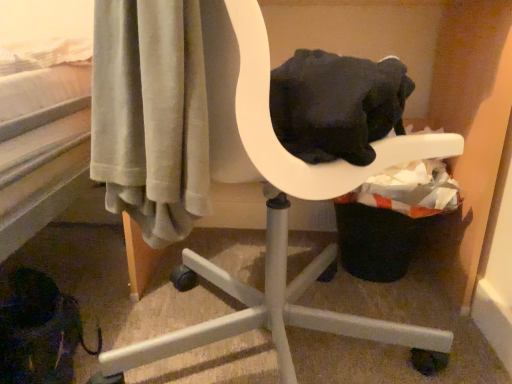
Question: Is black fabric laundry basket at lower right smaller than white plastic chair at center?

Choices:
 (A) yes
 (B) no

Answer: (A)

Question: Can you confirm if black fabric laundry basket at lower right is shorter than white plastic chair at center?

Choices:
 (A) no
 (B) yes

Answer: (B)

Question: Is black fabric laundry basket at lower right thinner than white plastic chair at center?

Choices:
 (A) yes
 (B) no

Answer: (A)

Question: Does black fabric laundry basket at lower right lie behind white plastic chair at center?

Choices:
 (A) no
 (B) yes

Answer: (B)

Question: From the image's perspective, is black fabric laundry basket at lower right on top of white plastic chair at center?

Choices:
 (A) no
 (B) yes

Answer: (A)

Question: Does black fabric laundry basket at lower right have a greater width compared to white plastic chair at center?

Choices:
 (A) yes
 (B) no

Answer: (B)

Question: Considering the relative sizes of white plastic chair at center and black fabric laundry basket at lower right in the image provided, is white plastic chair at center wider than black fabric laundry basket at lower right?

Choices:
 (A) no
 (B) yes

Answer: (B)

Question: Is white plastic chair at center at the left side of black fabric laundry basket at lower right?

Choices:
 (A) yes
 (B) no

Answer: (A)

Question: From the image's perspective, is white plastic chair at center on top of black fabric laundry basket at lower right?

Choices:
 (A) yes
 (B) no

Answer: (A)

Question: Is the position of white plastic chair at center less distant than that of black fabric laundry basket at lower right?

Choices:
 (A) yes
 (B) no

Answer: (A)

Question: Is white plastic chair at center far away from black fabric laundry basket at lower right?

Choices:
 (A) no
 (B) yes

Answer: (A)

Question: From the image's perspective, does white plastic chair at center appear lower than black fabric laundry basket at lower right?

Choices:
 (A) no
 (B) yes

Answer: (A)

Question: Is white plastic chair at center taller or shorter than black fabric laundry basket at lower right?

Choices:
 (A) short
 (B) tall

Answer: (B)